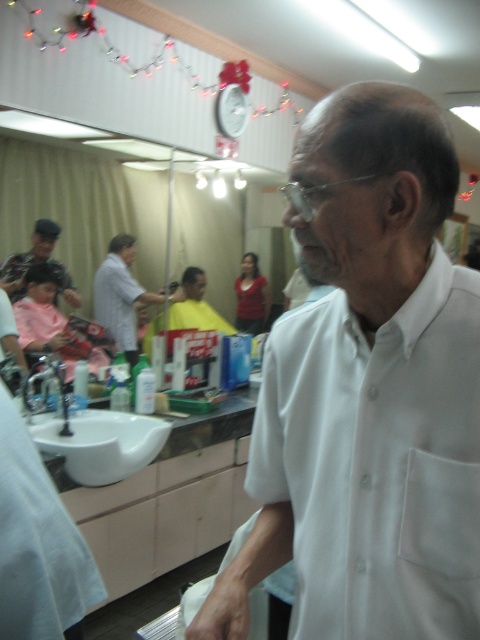
Can you confirm if light gray shirt at center is shorter than white ceramic sink at lower left?

In fact, light gray shirt at center may be taller than white ceramic sink at lower left.

Can you confirm if light gray shirt at center is positioned below white ceramic sink at lower left?

Incorrect, light gray shirt at center is not positioned below white ceramic sink at lower left.

Is point (129, 237) less distant than point (34, 378)?

No, it is behind (34, 378).

The width and height of the screenshot is (480, 640). What are the coordinates of `light gray shirt at center` in the screenshot? It's located at (122, 296).

Is matte black hair at left positioned in front of clear plastic glasses at center?

No, it is not.

From the picture: Is matte black hair at left to the left of clear plastic glasses at center from the viewer's perspective?

Correct, you'll find matte black hair at left to the left of clear plastic glasses at center.

This screenshot has width=480, height=640. What do you see at coordinates (36, 262) in the screenshot?
I see `matte black hair at left` at bounding box center [36, 262].

The width and height of the screenshot is (480, 640). In order to click on matte black hair at left in this screenshot , I will do `click(36, 262)`.

Between white smooth shirt at center and light gray shirt at center, which one is positioned lower?

white smooth shirt at center is lower down.

Is white smooth shirt at center shorter than light gray shirt at center?

Indeed, white smooth shirt at center has a lesser height compared to light gray shirt at center.

Is point (359, 550) positioned after point (113, 307)?

No, it is not.

Locate an element on the screen. white smooth shirt at center is located at coordinates (377, 461).